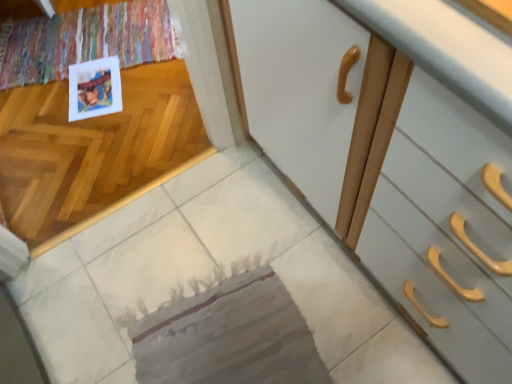
Find the location of a particular element. Image resolution: width=512 pixels, height=384 pixels. free space above textured gray mat at center (from a real-world perspective) is located at coordinates (227, 326).